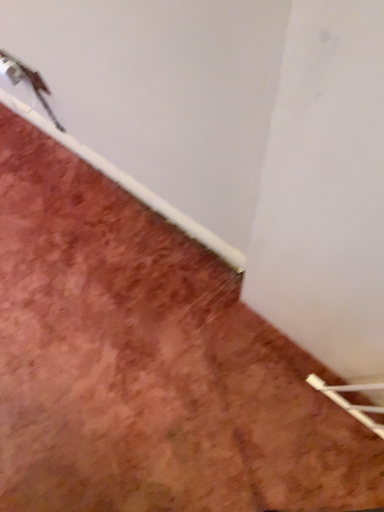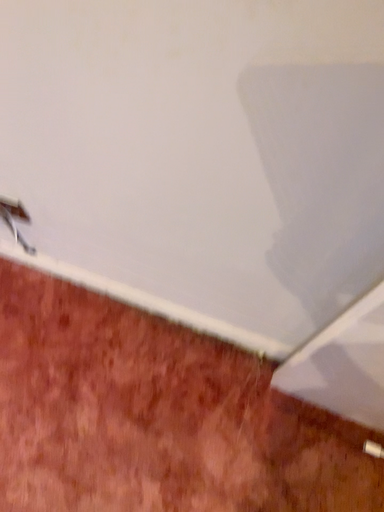
Question: Which way did the camera rotate in the video?

Choices:
 (A) rotated upward
 (B) rotated downward

Answer: (A)